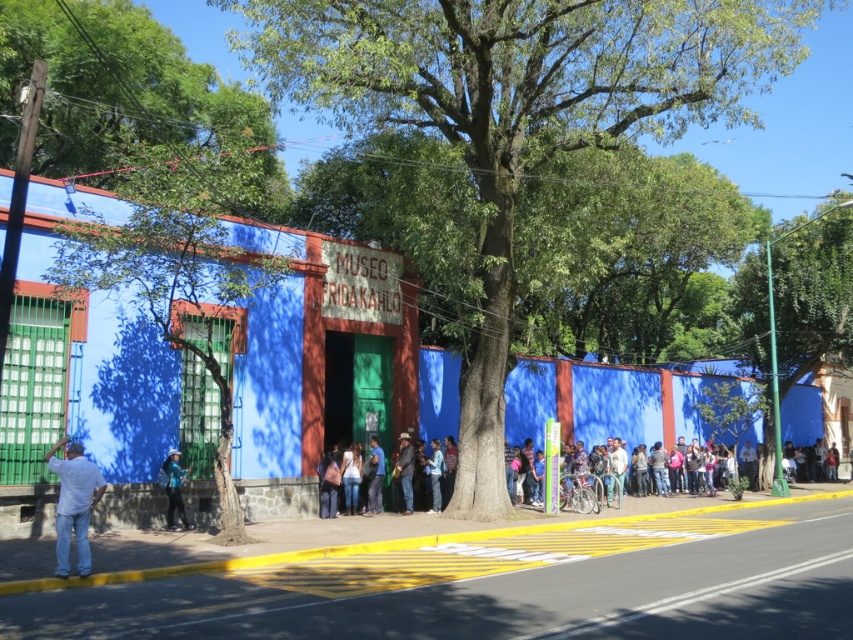
Question: Considering the real-world distances, which object is closest to the green leafy tree at center?

Choices:
 (A) white asphalt road at center
 (B) leather jacket at center

Answer: (B)

Question: Which object is positioned farthest from the light blue denim jeans at center?

Choices:
 (A) white asphalt road at center
 (B) green leafy tree at right
 (C) denim pants at center
 (D) blue jeans at center

Answer: (B)

Question: Can you confirm if white asphalt road at center is positioned below leather jacket at center?

Choices:
 (A) no
 (B) yes

Answer: (B)

Question: Does green leafy tree at upper center appear on the right side of blue jeans at center?

Choices:
 (A) yes
 (B) no

Answer: (B)

Question: Does green leafy tree at left lie behind white asphalt road at center?

Choices:
 (A) no
 (B) yes

Answer: (B)

Question: Estimate the real-world distances between objects in this image. Which object is closer to the white cotton shirt at lower left?

Choices:
 (A) leather jacket at center
 (B) denim jacket at lower left
 (C) green leafy tree at right
 (D) denim pants at center

Answer: (B)